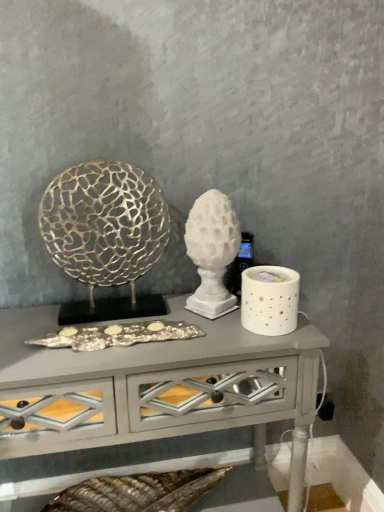
Find the location of a particular element. The width and height of the screenshot is (384, 512). space that is in front of white matte sculpture at center, which ranks as the 2th sculpture in left-to-right order is located at coordinates (213, 342).